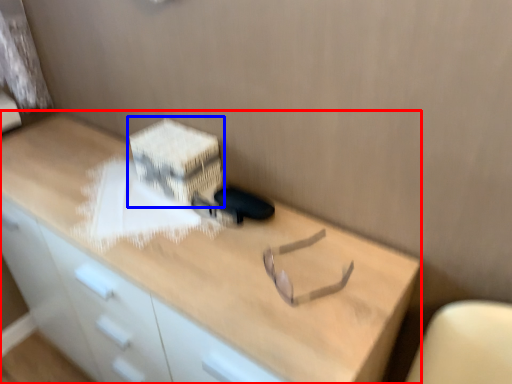
Question: Which of the following is the closest to the observer, desk (highlighted by a red box) or cardboard box (highlighted by a blue box)?

Choices:
 (A) desk
 (B) cardboard box

Answer: (A)